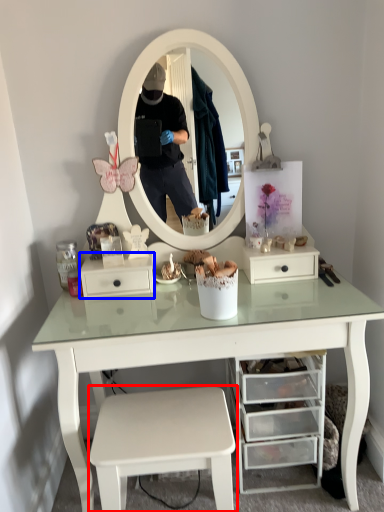
Question: Which object is closer to the camera taking this photo, stool (highlighted by a red box) or drawer (highlighted by a blue box)?

Choices:
 (A) stool
 (B) drawer

Answer: (A)